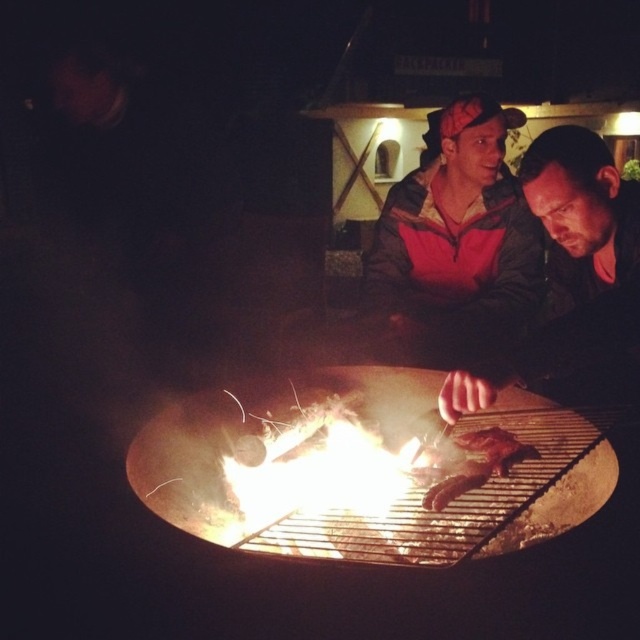
Measure the distance between camouflage jacket at center and charred wood at grill center.

The distance of camouflage jacket at center from charred wood at grill center is 3.66 feet.

Does camouflage jacket at center appear on the right side of charred wood at grill center?

Yes, camouflage jacket at center is to the right of charred wood at grill center.

You are a GUI agent. You are given a task and a screenshot of the screen. Output one action in this format:
    pyautogui.click(x=<x>, y=<y>)
    Task: Click on the camouflage jacket at center
    
    Given the screenshot: What is the action you would take?
    pos(456,241)

Does matte black jacket at center appear over charred wood at grill center?

Correct, matte black jacket at center is located above charred wood at grill center.

Is matte black jacket at center smaller than charred wood at grill center?

No, matte black jacket at center is not smaller than charred wood at grill center.

Which is in front, point (572, 276) or point (470, 477)?

Positioned in front is point (470, 477).

Where is `matte black jacket at center`? The width and height of the screenshot is (640, 640). matte black jacket at center is located at coordinates (570, 268).

Does camouflage jacket at center appear on the right side of matte black jacket at center?

In fact, camouflage jacket at center is to the left of matte black jacket at center.

Is camouflage jacket at center smaller than matte black jacket at center?

No, camouflage jacket at center is not smaller than matte black jacket at center.

The height and width of the screenshot is (640, 640). Describe the element at coordinates (456, 241) in the screenshot. I see `camouflage jacket at center` at that location.

Locate an element on the screen. The width and height of the screenshot is (640, 640). camouflage jacket at center is located at coordinates (456, 241).